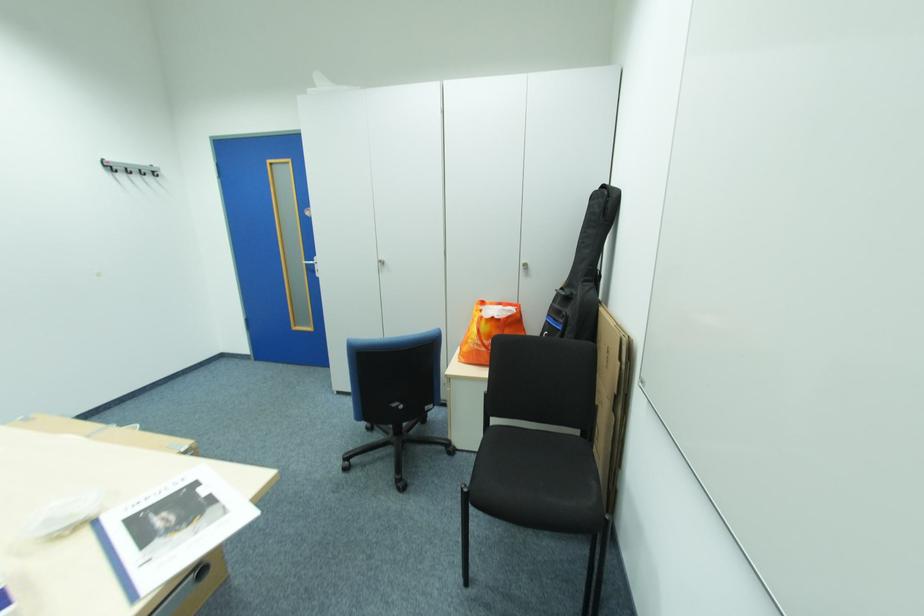
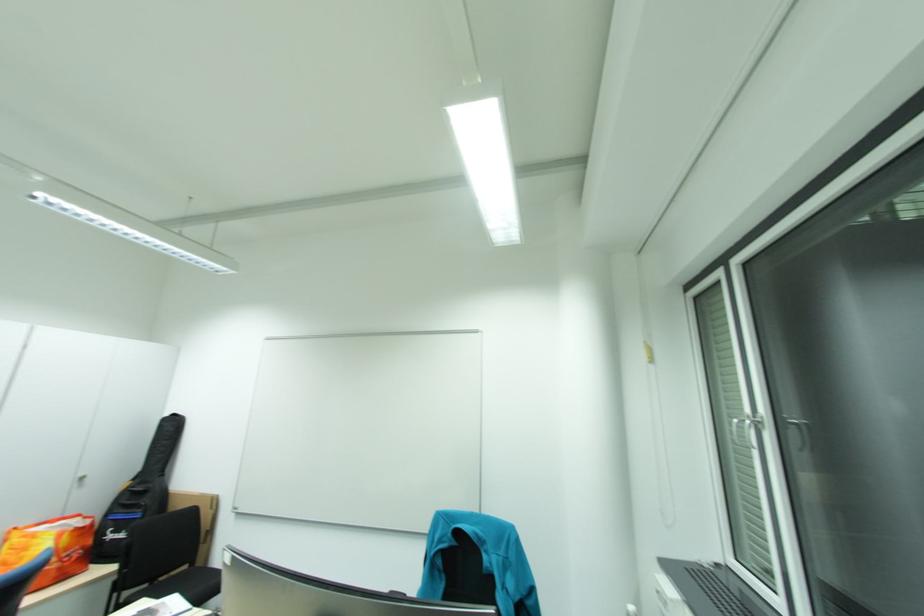
Where in the second image is the point corresponding to (572,318) from the first image?

(149, 508)